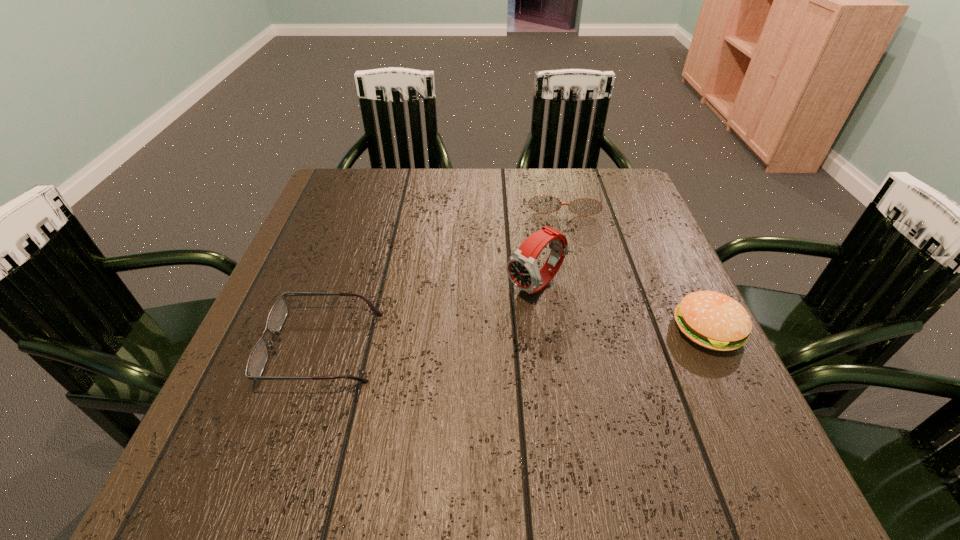
You are a GUI agent. You are given a task and a screenshot of the screen. Output one action in this format:
    pyautogui.click(x=<x>, y=<y>)
    Task: Click on the vacant space located on the face of the watch
    This screenshot has width=960, height=540.
    Given the screenshot: What is the action you would take?
    pyautogui.click(x=431, y=363)

Where is `free space located 0.290m on the face of the watch`? Image resolution: width=960 pixels, height=540 pixels. free space located 0.290m on the face of the watch is located at coordinates (405, 382).

This screenshot has height=540, width=960. In order to click on object positioned at the far edge in this screenshot , I will do `click(543, 203)`.

Where is `object positioned at the near edge`? object positioned at the near edge is located at coordinates (259, 355).

Image resolution: width=960 pixels, height=540 pixels. Find the location of `object present at the left edge`. object present at the left edge is located at coordinates (259, 355).

I want to click on patty at the right edge, so click(713, 320).

The width and height of the screenshot is (960, 540). Identify the location of sunglasses that is at the right edge. (543, 203).

Image resolution: width=960 pixels, height=540 pixels. Identify the location of object at the near left corner. (259, 355).

Where is `object that is at the far right corner`? object that is at the far right corner is located at coordinates (543, 203).

I want to click on vacant space at the far edge of the desktop, so click(387, 170).